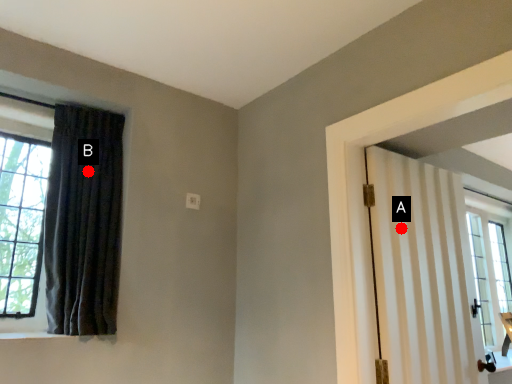
Question: Two points are circled on the image, labeled by A and B beside each circle. Which point is farther from the camera taking this photo?

Choices:
 (A) A is further
 (B) B is further

Answer: (B)